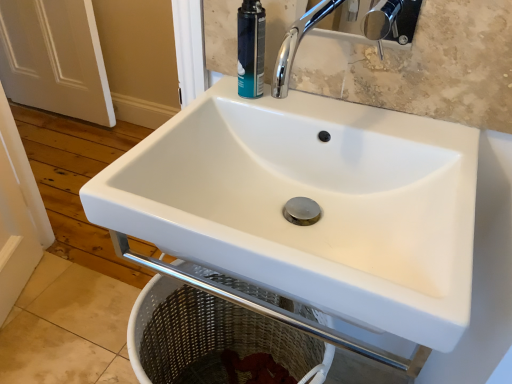
Question: Looking at their shapes, would you say teal matte shaving cream can at upper center is wider or thinner than white matte door at left?

Choices:
 (A) thin
 (B) wide

Answer: (A)

Question: Looking at the image, does teal matte shaving cream can at upper center seem bigger or smaller compared to white matte door at left?

Choices:
 (A) big
 (B) small

Answer: (B)

Question: Estimate the real-world distances between objects in this image. Which object is closer to the white matte door at left?

Choices:
 (A) white ceramic sink at center
 (B) teal matte shaving cream can at upper center

Answer: (A)

Question: Considering the real-world distances, which object is farthest from the teal matte shaving cream can at upper center?

Choices:
 (A) white ceramic sink at center
 (B) white matte door at left

Answer: (B)